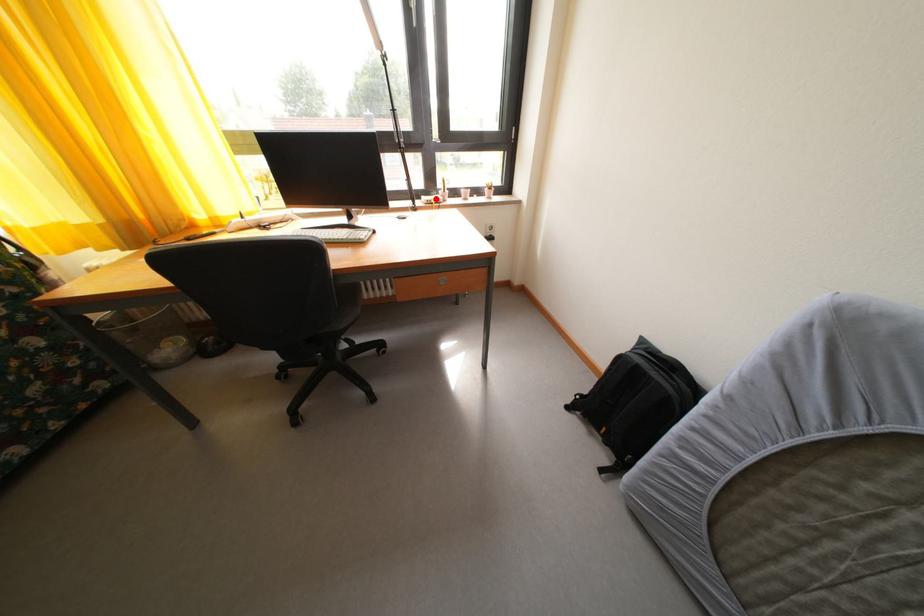
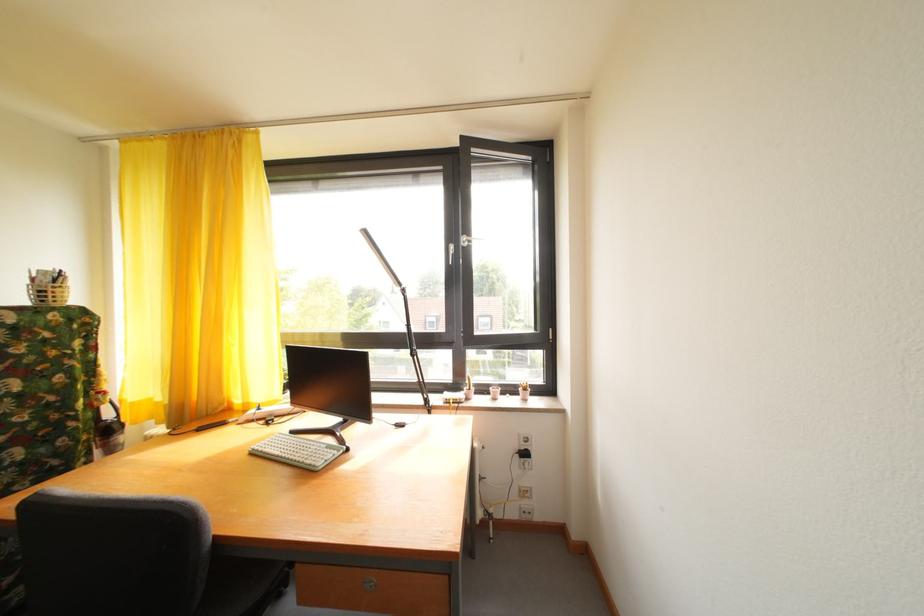
Question: A red point is marked in image1. In image2, is the corresponding 3D point closer to the camera or farther? Reply with the corresponding letter.

Choices:
 (A) The corresponding 3D point is closer.
 (B) The corresponding 3D point is farther.

Answer: (B)